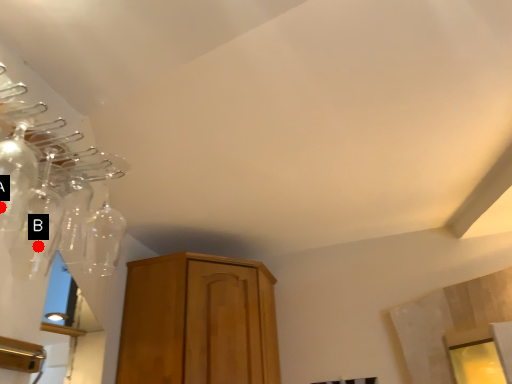
Question: Two points are circled on the image, labeled by A and B beside each circle. Which point is farther from the camera taking this photo?

Choices:
 (A) A is further
 (B) B is further

Answer: (B)